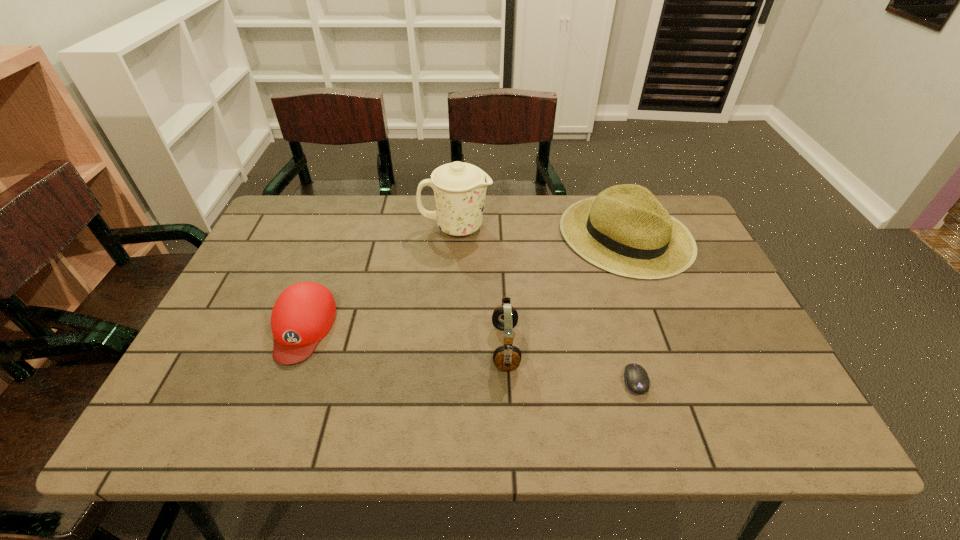
Identify the location of blank space located 0.200m on the ear cups of the headset. (405, 347).

Locate an element on the screen. free region located 0.050m on the front-facing side of the fourth tallest object is located at coordinates tap(280, 387).

This screenshot has width=960, height=540. I want to click on vacant point located 0.260m on the left of the computer mouse, so tap(504, 381).

Locate an element on the screen. The width and height of the screenshot is (960, 540). chinaware situated at the far edge is located at coordinates (459, 188).

The image size is (960, 540). I want to click on sunhat situated at the far edge, so click(625, 230).

Locate an element on the screen. This screenshot has width=960, height=540. object that is at the left edge is located at coordinates (304, 312).

Locate an element on the screen. object that is positioned at the right edge is located at coordinates (625, 230).

The height and width of the screenshot is (540, 960). I want to click on object situated at the far right corner, so click(x=625, y=230).

In the image, there is a desktop. At what (x,y) coordinates should I click in order to perform the action: click on vacant area at the far edge. Please return your answer as a coordinate pair (x, y). This screenshot has width=960, height=540. Looking at the image, I should click on (390, 242).

Where is `vacant position at the near edge of the desktop`? This screenshot has width=960, height=540. vacant position at the near edge of the desktop is located at coordinates (453, 411).